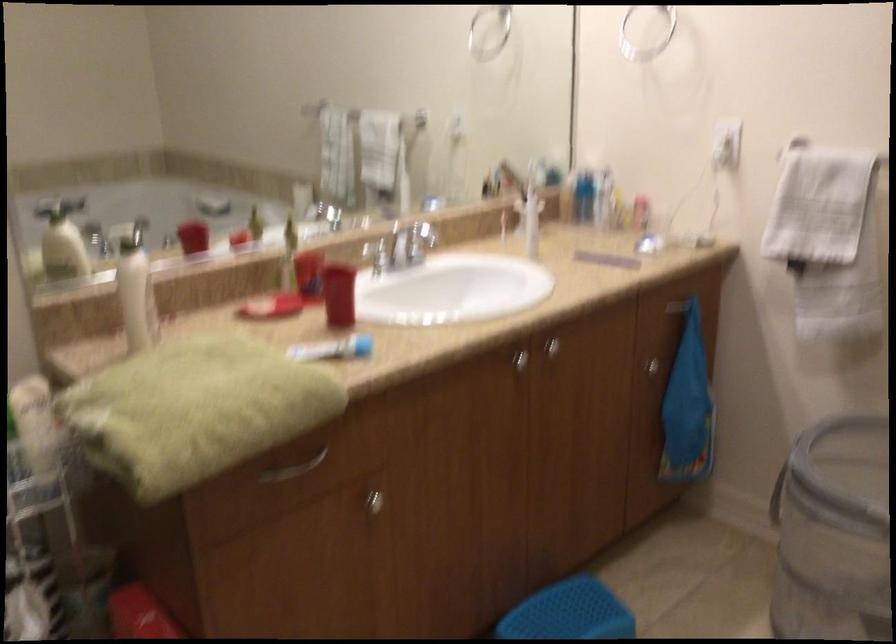
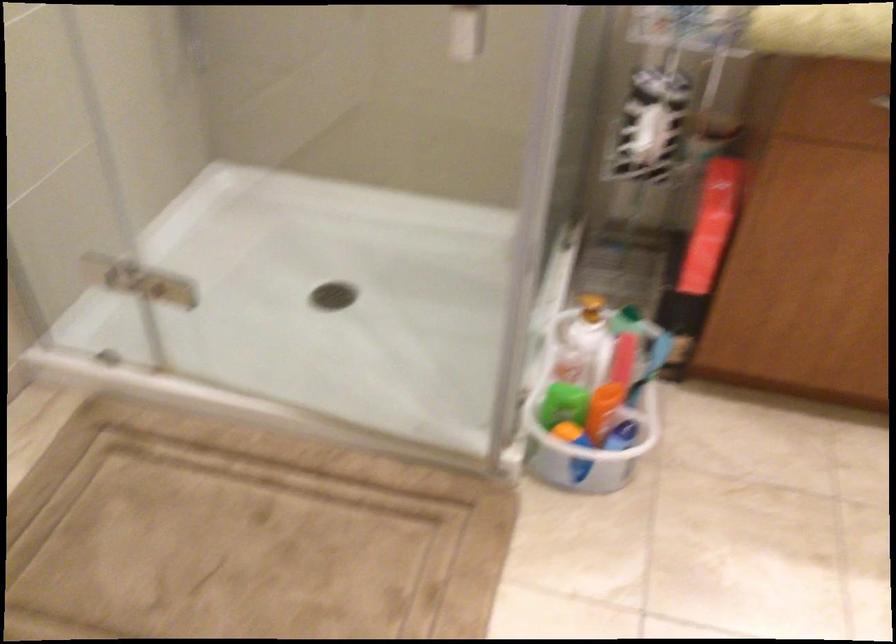
How did the camera likely rotate?

The camera's rotation is toward left-down.